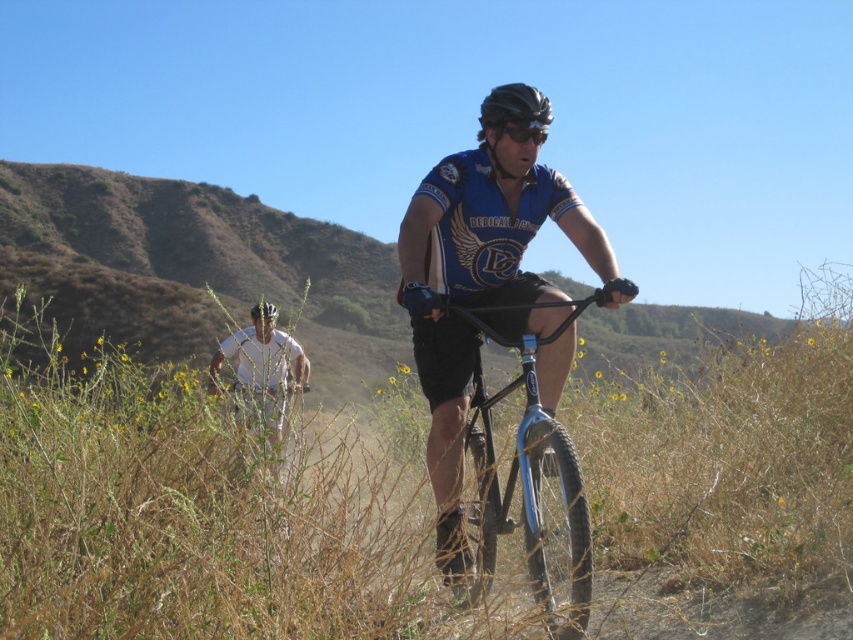
You are planning to place a small flag at point closer to you between point (514, 474) and point (494, 108). Which point should you choose?

You should choose point (514, 474) because it is closer to the viewer than point (494, 108).

You are a photographer trying to capture a clear photo of both the shiny blue frame at center and the black matte helmet at center. The camera can only focus on objects within a 3.5 feet range. Can you take a photo that includes both objects in focus?

The shiny blue frame at center and the black matte helmet at center are 4.08 feet apart. Since the camera can only focus on objects within a 3.5 feet range, the distance between them exceeds the focus range. Therefore, you cannot take a photo that includes both objects in focus.